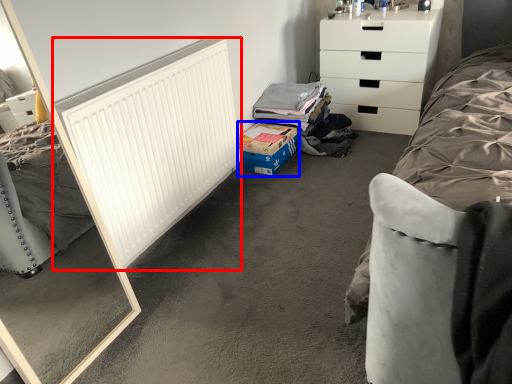
Question: Which of the following is the closest to the observer, radiator (highlighted by a red box) or cardboard box (highlighted by a blue box)?

Choices:
 (A) radiator
 (B) cardboard box

Answer: (A)